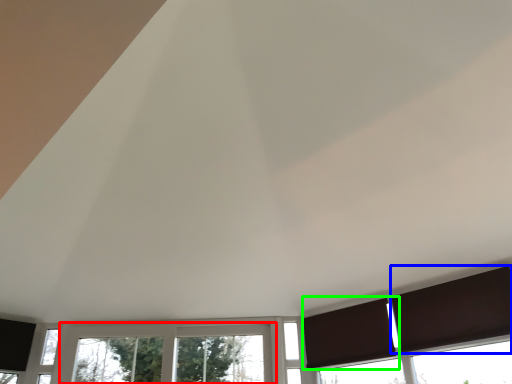
Question: Which object is positioned closest to window (highlighted by a red box)? Select from curtain (highlighted by a blue box) and curtain (highlighted by a green box).

Choices:
 (A) curtain
 (B) curtain

Answer: (B)